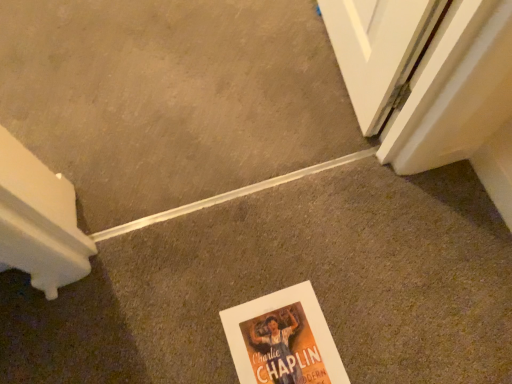
You are a GUI agent. You are given a task and a screenshot of the screen. Output one action in this format:
    pyautogui.click(x=<x>, y=<y>)
    Task: Click on the blank space situated above white paper poster at center (from a real-world perspective)
    The height and width of the screenshot is (384, 512).
    Given the screenshot: What is the action you would take?
    pyautogui.click(x=287, y=343)